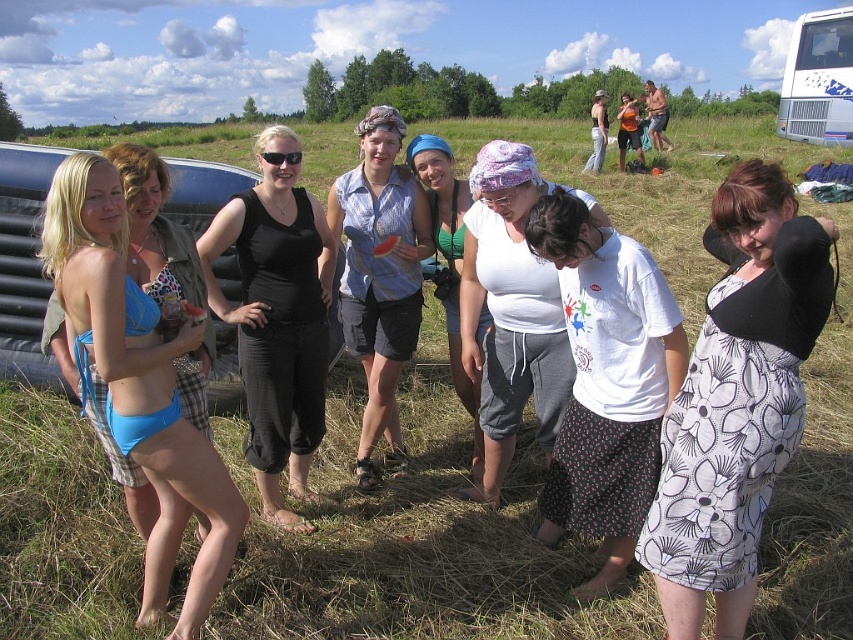
In the scene shown: Can you confirm if black matte tank top at left is smaller than white cotton tank top at center?

Indeed, black matte tank top at left has a smaller size compared to white cotton tank top at center.

Describe the element at coordinates (277, 317) in the screenshot. I see `black matte tank top at left` at that location.

Find the location of a particular element. The width and height of the screenshot is (853, 640). black matte tank top at left is located at coordinates (277, 317).

Which is below, white cotton tank top at center or white cotton shirt at center?

white cotton tank top at center

Between point (552, 394) and point (445, 292), which one is positioned behind?

The point (445, 292) is more distant.

Does point (538, 381) come behind point (454, 307)?

No.

Where is `white cotton tank top at center`? The height and width of the screenshot is (640, 853). white cotton tank top at center is located at coordinates (511, 308).

What do you see at coordinates (138, 381) in the screenshot?
I see `blue fabric bikini bottom at left` at bounding box center [138, 381].

Which is in front, point (97, 276) or point (440, 161)?

Point (97, 276) is in front.

Where is `blue fabric bikini bottom at left`? Image resolution: width=853 pixels, height=640 pixels. blue fabric bikini bottom at left is located at coordinates (138, 381).